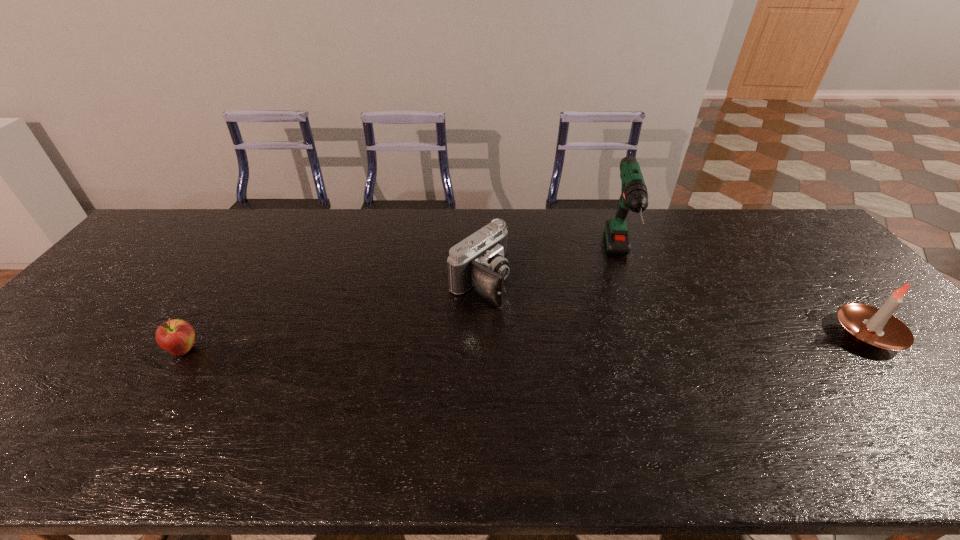
Identify which object is located as the second nearest to the drill. Please provide its 2D coordinates. Your answer should be formatted as a tuple, i.e. [(x, y)], where the tuple contains the x and y coordinates of a point satisfying the conditions above.

[(876, 328)]

Locate which object ranks in proximity to the second shortest object. Please provide its 2D coordinates. Your answer should be formatted as a tuple, i.e. [(x, y)], where the tuple contains the x and y coordinates of a point satisfying the conditions above.

[(634, 196)]

Find the location of a particular element. This screenshot has width=960, height=540. vacant area that satisfies the following two spatial constraints: 1. on the front side of the third tallest object; 2. on the right side of the candle is located at coordinates [x=479, y=334].

Identify the location of vacant position in the image that satisfies the following two spatial constraints: 1. on the back side of the third object from right to left; 2. on the right side of the apple. (228, 281).

Identify the location of free space that satisfies the following two spatial constraints: 1. on the back side of the second shortest object; 2. on the right side of the drill. The height and width of the screenshot is (540, 960). (479, 260).

Where is `free spot that satisfies the following two spatial constraints: 1. on the back side of the shortest object; 2. on the left side of the drill`? The width and height of the screenshot is (960, 540). free spot that satisfies the following two spatial constraints: 1. on the back side of the shortest object; 2. on the left side of the drill is located at coordinates (243, 260).